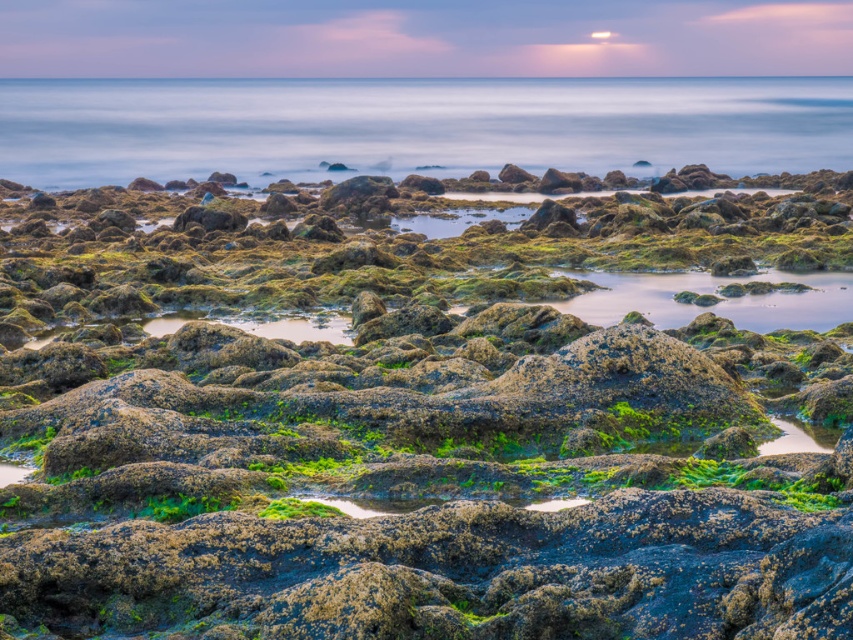
Who is positioned more to the right, green mossy rock at center or smooth water at center?

Positioned to the right is green mossy rock at center.

Is green mossy rock at center to the left of smooth water at center from the viewer's perspective?

No, green mossy rock at center is not to the left of smooth water at center.

I want to click on green mossy rock at center, so click(x=415, y=428).